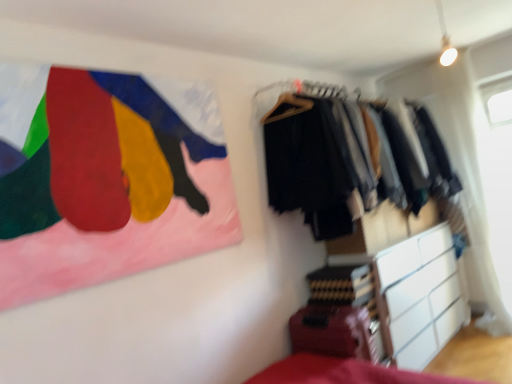
Consider the image. What is the approximate height of painted fabric flag at upper left?

The height of painted fabric flag at upper left is 1.02 meters.

The height and width of the screenshot is (384, 512). I want to click on transparent plastic window screen at upper right, so click(x=497, y=172).

Find the location of a particular element. This screenshot has height=384, width=512. painted fabric flag at upper left is located at coordinates (106, 178).

Is white matte chest of drawers at lower right to the left or to the right of transparent plastic window screen at upper right in the image?

In the image, white matte chest of drawers at lower right appears on the left side of transparent plastic window screen at upper right.

Is white matte chest of drawers at lower right next to transparent plastic window screen at upper right?

No, white matte chest of drawers at lower right is not beside transparent plastic window screen at upper right.

Based on the photo, between white matte chest of drawers at lower right and transparent plastic window screen at upper right, which one has less height?

white matte chest of drawers at lower right.

Is white matte chest of drawers at lower right positioned beyond the bounds of transparent plastic window screen at upper right?

That's correct, white matte chest of drawers at lower right is outside of transparent plastic window screen at upper right.

Considering the positions of objects transparent plastic window screen at upper right and painted fabric flag at upper left in the image provided, who is in front, transparent plastic window screen at upper right or painted fabric flag at upper left?

painted fabric flag at upper left is in front.

The height and width of the screenshot is (384, 512). Find the location of `window screen directly beneath the painted fabric flag at upper left (from a real-world perspective)`. window screen directly beneath the painted fabric flag at upper left (from a real-world perspective) is located at coordinates (497, 172).

Which is nearer, (x=483, y=149) or (x=238, y=221)?

Positioned in front is point (x=238, y=221).

Looking at this image, from the image's perspective, is transparent plastic window screen at upper right below painted fabric flag at upper left?

Indeed, from the image's perspective, transparent plastic window screen at upper right is shown beneath painted fabric flag at upper left.

Based on the photo, from a real-world perspective, is transparent plastic window screen at upper right over textured fabric clothes at right?

Incorrect, from a real-world perspective, transparent plastic window screen at upper right is lower than textured fabric clothes at right.

From the image's perspective, is transparent plastic window screen at upper right below textured fabric clothes at right?

Indeed, from the image's perspective, transparent plastic window screen at upper right is shown beneath textured fabric clothes at right.

Can you tell me how much transparent plastic window screen at upper right and textured fabric clothes at right differ in facing direction?

89.3 degrees separate the facing orientations of transparent plastic window screen at upper right and textured fabric clothes at right.

Would you say transparent plastic window screen at upper right is outside textured fabric clothes at right?

Indeed, transparent plastic window screen at upper right is completely outside textured fabric clothes at right.

Between transparent plastic window screen at upper right and white matte chest of drawers at lower right, which one is positioned in front?

white matte chest of drawers at lower right is in front.

Is transparent plastic window screen at upper right thinner than white matte chest of drawers at lower right?

Indeed, transparent plastic window screen at upper right has a lesser width compared to white matte chest of drawers at lower right.

From a real-world perspective, relative to white matte chest of drawers at lower right, is transparent plastic window screen at upper right vertically above or below?

Clearly, from a real-world perspective, transparent plastic window screen at upper right is above white matte chest of drawers at lower right.

Who is taller, transparent plastic window screen at upper right or white matte chest of drawers at lower right?

Standing taller between the two is transparent plastic window screen at upper right.

From the image's perspective, between painted fabric flag at upper left and white matte chest of drawers at lower right, who is located below?

white matte chest of drawers at lower right is shown below in the image.

Considering the positions of objects painted fabric flag at upper left and white matte chest of drawers at lower right in the image provided, who is in front, painted fabric flag at upper left or white matte chest of drawers at lower right?

painted fabric flag at upper left.

Between painted fabric flag at upper left and white matte chest of drawers at lower right, which one has less height?

white matte chest of drawers at lower right is shorter.

Is painted fabric flag at upper left spatially inside white matte chest of drawers at lower right, or outside of it?

painted fabric flag at upper left is spatially situated outside white matte chest of drawers at lower right.

Is textured fabric clothes at right completely or partially outside of painted fabric flag at upper left?

Yes, textured fabric clothes at right is located beyond the bounds of painted fabric flag at upper left.

Is textured fabric clothes at right oriented away from painted fabric flag at upper left?

No, textured fabric clothes at right is not facing the opposite direction of painted fabric flag at upper left.

Considering the sizes of objects textured fabric clothes at right and painted fabric flag at upper left in the image provided, who is wider, textured fabric clothes at right or painted fabric flag at upper left?

Wider between the two is textured fabric clothes at right.

Between textured fabric clothes at right and painted fabric flag at upper left, which one is positioned in front?

Positioned in front is painted fabric flag at upper left.

How different are the orientations of textured fabric clothes at right and transparent plastic window screen at upper right in degrees?

The angle between the facing direction of textured fabric clothes at right and the facing direction of transparent plastic window screen at upper right is 89.3 degrees.

Does textured fabric clothes at right have a lesser height compared to transparent plastic window screen at upper right?

Yes.

Based on the photo, would you consider textured fabric clothes at right to be distant from transparent plastic window screen at upper right?

That's right, there is a large distance between textured fabric clothes at right and transparent plastic window screen at upper right.

Is textured fabric clothes at right facing away from transparent plastic window screen at upper right?

That's not correct — textured fabric clothes at right is not looking away from transparent plastic window screen at upper right.

Identify the location of window screen above the white matte chest of drawers at lower right (from the image's perspective). The image size is (512, 384). (497, 172).

Locate an element on the screen. Image resolution: width=512 pixels, height=384 pixels. window screen below the painted fabric flag at upper left (from a real-world perspective) is located at coordinates (497, 172).

Looking at the image, which one is located further to transparent plastic window screen at upper right, painted fabric flag at upper left or white matte chest of drawers at lower right?

Among the two, painted fabric flag at upper left is located further to transparent plastic window screen at upper right.

Considering their positions, is transparent plastic window screen at upper right positioned further to textured fabric clothes at right than white matte chest of drawers at lower right?

The object further to textured fabric clothes at right is transparent plastic window screen at upper right.

From the image, which object appears to be farther from white matte chest of drawers at lower right, painted fabric flag at upper left or textured fabric clothes at right?

Among the two, painted fabric flag at upper left is located further to white matte chest of drawers at lower right.

Which object lies nearer to the anchor point transparent plastic window screen at upper right, textured fabric clothes at right or painted fabric flag at upper left?

The object closer to transparent plastic window screen at upper right is textured fabric clothes at right.

Consider the image. Considering their positions, is white matte chest of drawers at lower right positioned further to transparent plastic window screen at upper right than textured fabric clothes at right?

textured fabric clothes at right is further to transparent plastic window screen at upper right.

Looking at the image, which one is located further to textured fabric clothes at right, painted fabric flag at upper left or transparent plastic window screen at upper right?

transparent plastic window screen at upper right.

Which object lies nearer to the anchor point painted fabric flag at upper left, white matte chest of drawers at lower right or textured fabric clothes at right?

Among the two, textured fabric clothes at right is located nearer to painted fabric flag at upper left.

Based on their spatial positions, is textured fabric clothes at right or painted fabric flag at upper left further from white matte chest of drawers at lower right?

painted fabric flag at upper left is positioned further to the anchor white matte chest of drawers at lower right.

At what (x,y) coordinates should I click in order to perform the action: click on chest of drawers between textured fabric clothes at right and transparent plastic window screen at upper right in the horizontal direction. Please return your answer as a coordinate pair (x, y). The height and width of the screenshot is (384, 512). Looking at the image, I should click on 419,297.

Find the location of `closet between painted fabric flag at upper left and white matte chest of drawers at lower right in the horizontal direction`. closet between painted fabric flag at upper left and white matte chest of drawers at lower right in the horizontal direction is located at coordinates (348, 156).

Where is `closet between painted fabric flag at upper left and transparent plastic window screen at upper right`? The image size is (512, 384). closet between painted fabric flag at upper left and transparent plastic window screen at upper right is located at coordinates (348, 156).

Locate an element on the screen. This screenshot has width=512, height=384. the chest of drawers located between painted fabric flag at upper left and transparent plastic window screen at upper right in the left-right direction is located at coordinates (419, 297).